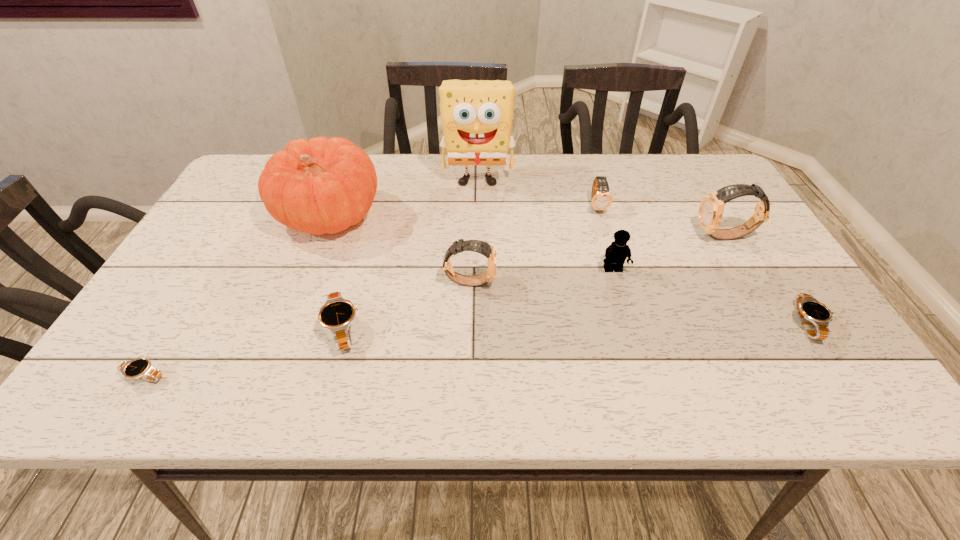
Where is `the second gold watch from left to right`? The width and height of the screenshot is (960, 540). the second gold watch from left to right is located at coordinates (601, 199).

Identify the location of the seventh tallest object. The height and width of the screenshot is (540, 960). (337, 314).

Where is `the second black watch from left to right`? the second black watch from left to right is located at coordinates (337, 314).

Where is `the rightmost black watch`? The image size is (960, 540). the rightmost black watch is located at coordinates (808, 309).

This screenshot has width=960, height=540. I want to click on the second shortest watch, so 808,309.

Identify the location of the leftmost black watch. The width and height of the screenshot is (960, 540). (141, 368).

Find the location of `the leftmost object`. the leftmost object is located at coordinates pos(141,368).

The width and height of the screenshot is (960, 540). I want to click on free space located on the face of the sponge, so click(x=477, y=241).

Where is `free space located 0.070m on the right of the second tallest object`? The height and width of the screenshot is (540, 960). free space located 0.070m on the right of the second tallest object is located at coordinates (408, 217).

Where is `vacant region located on the face of the biggest gold watch`? vacant region located on the face of the biggest gold watch is located at coordinates (642, 237).